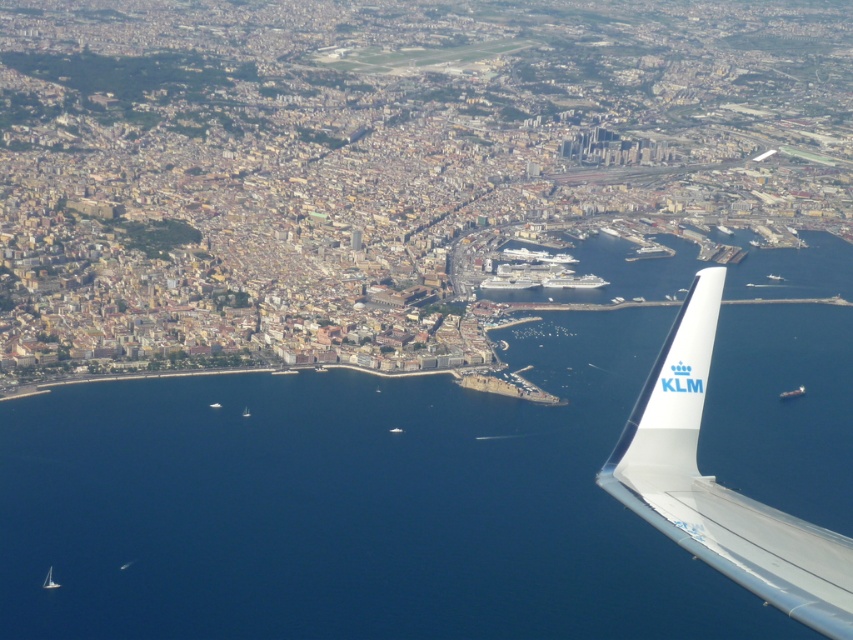
You are a passenger on a KLM flight and want to know which vessel is larger between the white glossy cruise ship at center and the white plastic boat at lower center. Can you determine this based on the aerial view?

The white glossy cruise ship at center is bigger than the white plastic boat at lower center, so the cruise ship is larger.

You are a passenger on a flight and looking out the window. You see the white metallic wing at right and the white plastic boat at lower left. Which object is closer to you?

The white metallic wing at right is closer to you because it is positioned under the white plastic boat at lower left, which means it is in front of the boat from your perspective.

You are a pilot flying over a coastal city and notice the white metallic wing at right from your airplane window. Based on its position, can you estimate its coordinates in the image?

The white metallic wing at right is located at coordinates point (720,484).